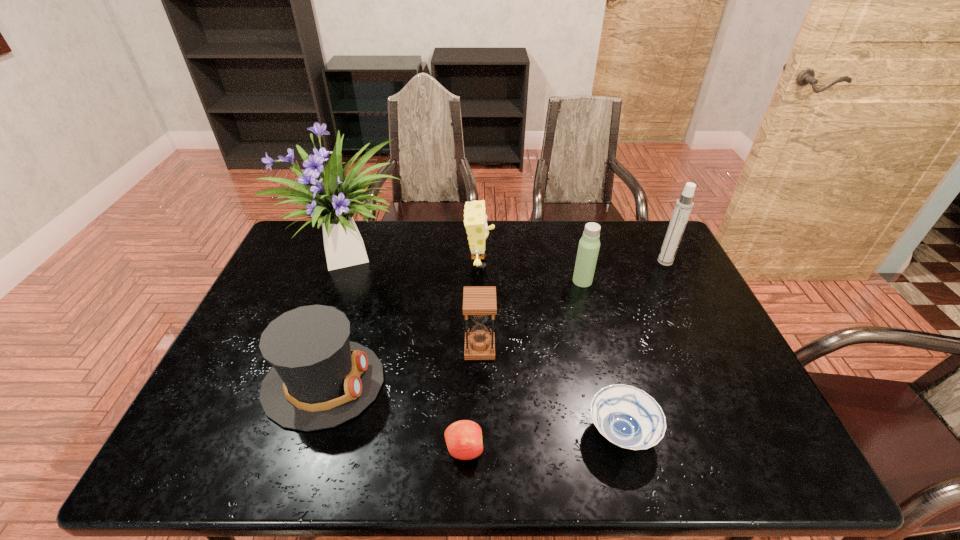
Image resolution: width=960 pixels, height=540 pixels. Identify the location of vacant point located on the back of the rightmost object. (651, 234).

Locate an element on the screen. free spot located 0.350m on the left of the thermos bottle is located at coordinates (x=460, y=281).

The width and height of the screenshot is (960, 540). I want to click on vacant space located on the face of the sponge, so click(x=570, y=263).

Identify the location of free location located on the back of the hourglass. The width and height of the screenshot is (960, 540). (480, 316).

Identify the location of vacant area situated with goggles on the front of the dress hat. (481, 383).

This screenshot has width=960, height=540. In order to click on vacant area located 0.310m on the back of the apple in this screenshot , I will do `click(468, 329)`.

Where is `vacant area situated 0.150m on the right of the soup bowl`? This screenshot has width=960, height=540. vacant area situated 0.150m on the right of the soup bowl is located at coordinates (723, 433).

This screenshot has height=540, width=960. In order to click on flower arrangement positioned at the far edge in this screenshot , I will do 336,199.

The height and width of the screenshot is (540, 960). I want to click on aerosol can positioned at the far edge, so pos(684,205).

Find the location of `sponge located at the far edge`. sponge located at the far edge is located at coordinates (x=475, y=220).